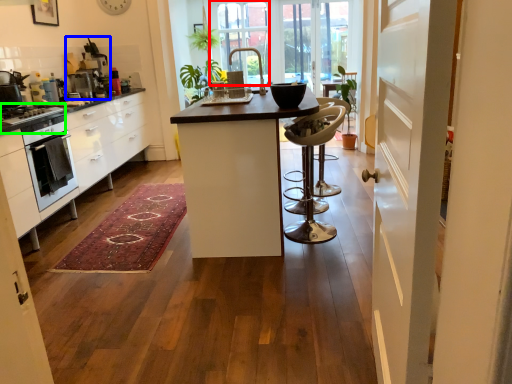
Question: Considering the real-world distances, which object is closest to window (highlighted by a red box)? appliance (highlighted by a blue box) or stove (highlighted by a green box).

Choices:
 (A) appliance
 (B) stove

Answer: (A)